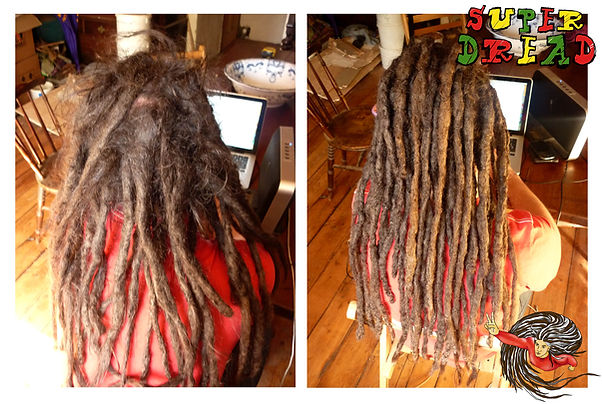
Where is `wood chair`? Image resolution: width=602 pixels, height=404 pixels. wood chair is located at coordinates (49, 154), (340, 130).